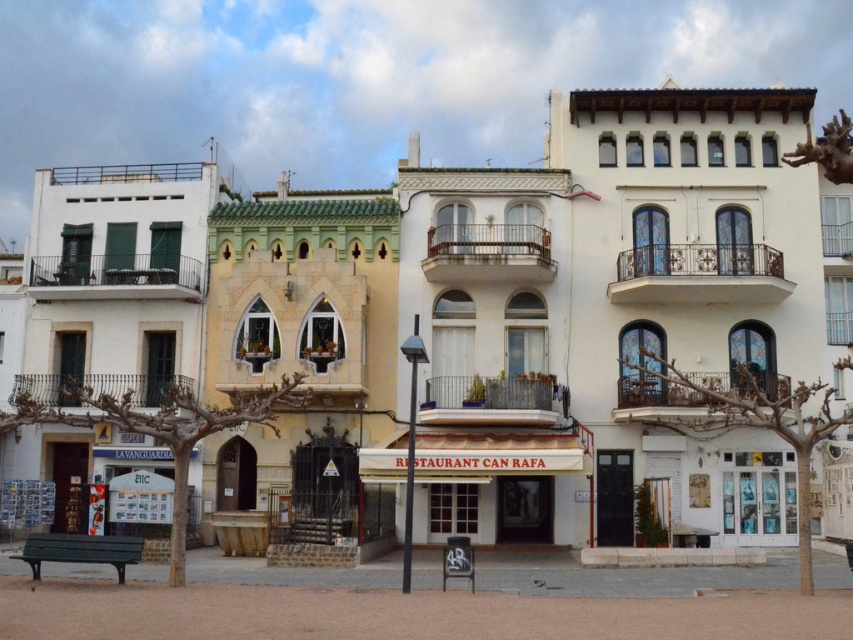
Can you confirm if white matte building at left is positioned below beige textured building at center?

No, white matte building at left is not below beige textured building at center.

Is white matte building at left to the left of beige textured building at center from the viewer's perspective?

Yes, white matte building at left is to the left of beige textured building at center.

At what (x,y) coordinates should I click in order to perform the action: click on white matte building at left. Please return your answer as a coordinate pair (x, y). This screenshot has height=640, width=853. Looking at the image, I should click on (115, 280).

The height and width of the screenshot is (640, 853). Identify the location of white matte building at left. (115, 280).

Who is shorter, white textured building at center or white matte building at left?

With less height is white textured building at center.

Does white textured building at center have a lesser height compared to white matte building at left?

Indeed, white textured building at center has a lesser height compared to white matte building at left.

Where is `white textured building at center`? The image size is (853, 640). white textured building at center is located at coordinates (693, 288).

In the scene shown: Between white textured building at center and beige textured building at center, which one has more height?

With more height is white textured building at center.

Can you confirm if white textured building at center is positioned to the right of beige textured building at center?

Indeed, white textured building at center is positioned on the right side of beige textured building at center.

Who is more forward, [622,445] or [392,262]?

Positioned in front is point [622,445].

Where is `white textured building at center`? white textured building at center is located at coordinates (693, 288).